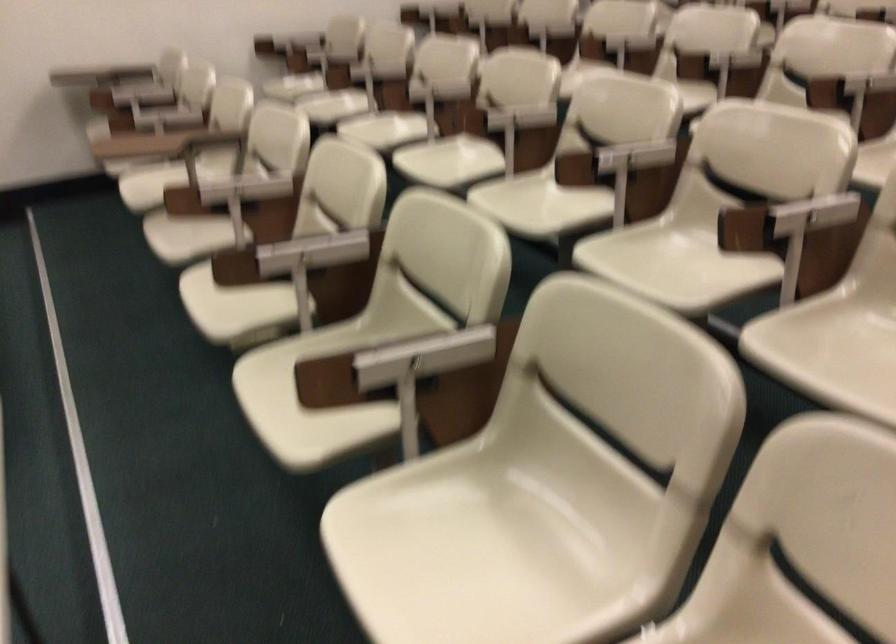
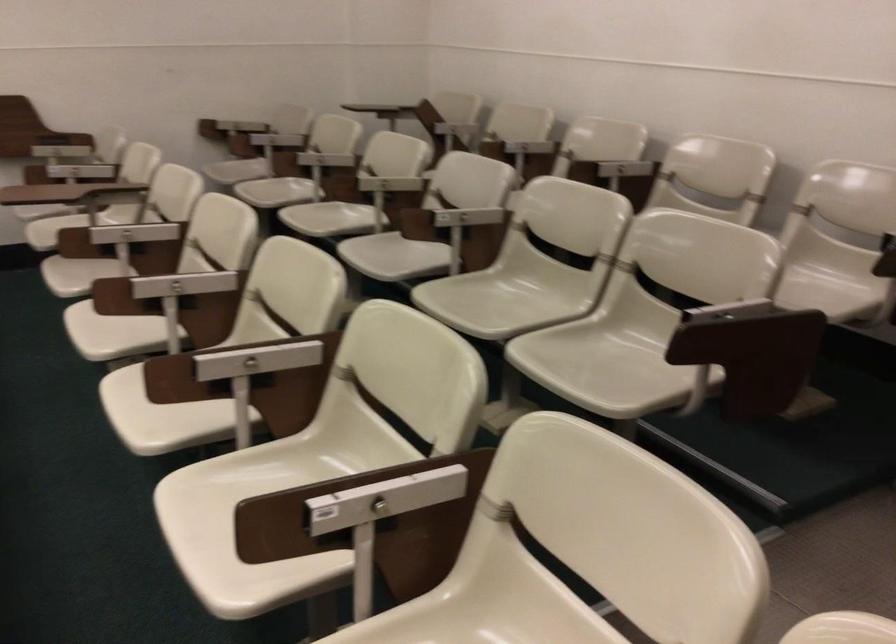
The images are taken continuously from a first-person perspective. In which direction are you moving?

The cameraman moved toward right, forward.